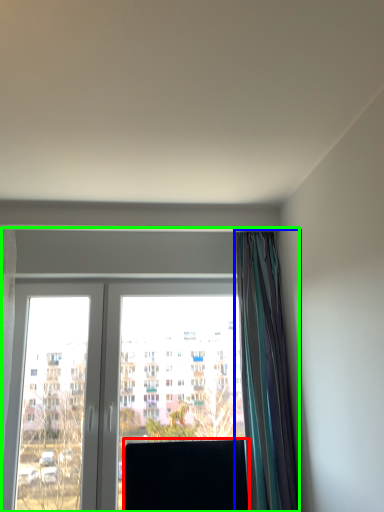
Question: Considering the real-world distances, which object is closest to window screen (highlighted by a red box)? curtain (highlighted by a blue box) or window (highlighted by a green box).

Choices:
 (A) curtain
 (B) window

Answer: (B)